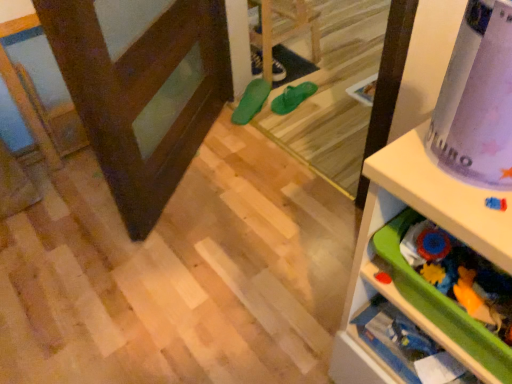
You are a GUI agent. You are given a task and a screenshot of the screen. Output one action in this format:
    pyautogui.click(x=<x>, y=<y>)
    Task: Click on the vacant region below green rubber flip-flops at center, which ranks as the 2th footwear in front-to-back order (from a real-world perspective)
    The height and width of the screenshot is (384, 512).
    Given the screenshot: What is the action you would take?
    pyautogui.click(x=292, y=97)